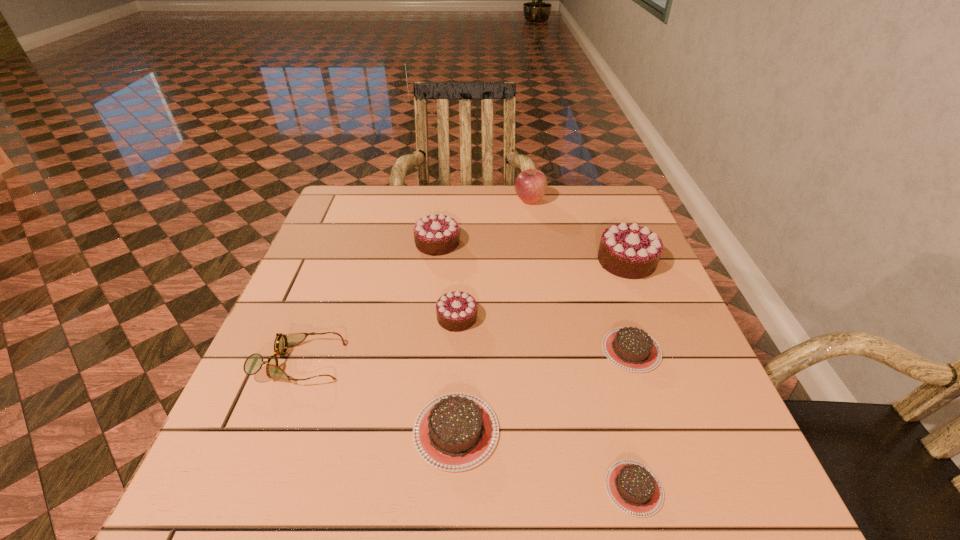
Locate an element on the screen. vacant area that lies between the fourth tallest chocolate cake and the smallest brown chocolate cake is located at coordinates (545, 460).

Locate an element on the screen. vacant space that's between the fourth tallest chocolate cake and the shortest object is located at coordinates (545, 460).

The height and width of the screenshot is (540, 960). In order to click on the fourth closest object to the apple in this screenshot , I will do pyautogui.click(x=632, y=349).

Point out which object is positioned as the fifth nearest to the nearest chocolate chocolate cake. Please provide its 2D coordinates. Your answer should be formatted as a tuple, i.e. [(x, y)], where the tuple contains the x and y coordinates of a point satisfying the conditions above.

[(630, 251)]

What are the coordinates of `chocolate cake that stands as the fourth closest to the smallest brown chocolate cake` in the screenshot? It's located at (630, 251).

Locate an element on the screen. The image size is (960, 540). chocolate cake object that ranks as the sixth closest to the apple is located at coordinates (634, 488).

Choose which chocolate chocolate cake is the second nearest neighbor to the tallest chocolate cake. Please provide its 2D coordinates. Your answer should be formatted as a tuple, i.e. [(x, y)], where the tuple contains the x and y coordinates of a point satisfying the conditions above.

[(437, 234)]

Locate which chocolate chocolate cake is the third closest to the smallest brown chocolate cake. Please provide its 2D coordinates. Your answer should be formatted as a tuple, i.e. [(x, y)], where the tuple contains the x and y coordinates of a point satisfying the conditions above.

[(437, 234)]

You are a GUI agent. You are given a task and a screenshot of the screen. Output one action in this format:
    pyautogui.click(x=<x>, y=<y>)
    Task: Click on the brown chocolate cake that is the third closest to the leftmost object
    The height and width of the screenshot is (540, 960).
    Given the screenshot: What is the action you would take?
    [632, 349]

Identify which brown chocolate cake is located as the second nearest to the second smallest brown chocolate cake. Please provide its 2D coordinates. Your answer should be formatted as a tuple, i.e. [(x, y)], where the tuple contains the x and y coordinates of a point satisfying the conditions above.

[(454, 432)]